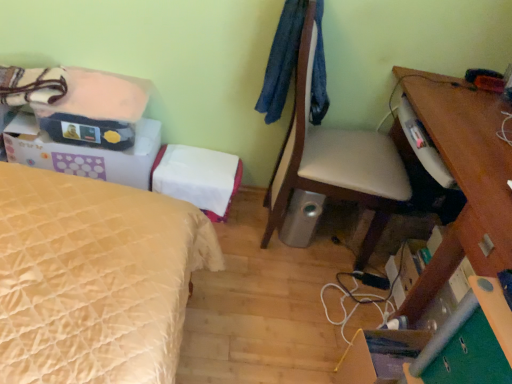
You are a GUI agent. You are given a task and a screenshot of the screen. Output one action in this format:
    pyautogui.click(x=<x>, y=<y>)
    Task: Click on the free point below white leather chair at center (from a real-world perspective)
    The image size is (512, 384).
    Given the screenshot: What is the action you would take?
    pyautogui.click(x=317, y=247)